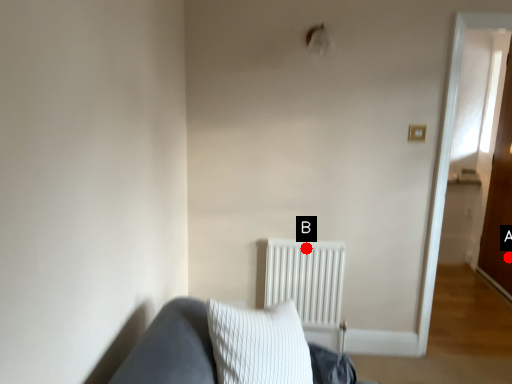
Question: Two points are circled on the image, labeled by A and B beside each circle. Which of the following is the farthest from the observer?

Choices:
 (A) A is further
 (B) B is further

Answer: (A)